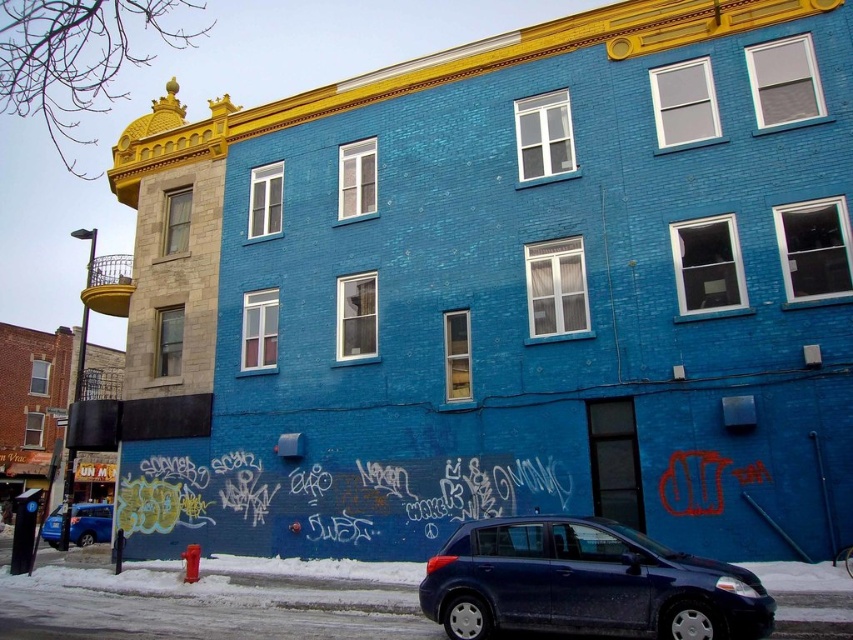
Question: Is satin blue hatchback at lower center smaller than matte blue sedan at lower left?

Choices:
 (A) no
 (B) yes

Answer: (B)

Question: Which object is farther from the camera taking this photo?

Choices:
 (A) satin blue hatchback at lower center
 (B) matte blue sedan at lower left

Answer: (B)

Question: Can you confirm if satin blue hatchback at lower center is positioned to the right of matte blue sedan at lower left?

Choices:
 (A) no
 (B) yes

Answer: (B)

Question: From the image, what is the correct spatial relationship of satin blue hatchback at lower center in relation to matte blue sedan at lower left?

Choices:
 (A) below
 (B) above

Answer: (B)

Question: Which object appears closest to the camera in this image?

Choices:
 (A) matte blue sedan at lower left
 (B) satin blue hatchback at lower center

Answer: (B)